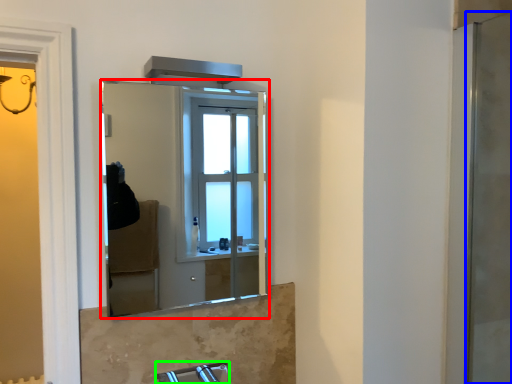
Question: Which is farther away from mirror (highlighted by a red box)? screen door (highlighted by a blue box) or faucet (highlighted by a green box)?

Choices:
 (A) screen door
 (B) faucet

Answer: (A)